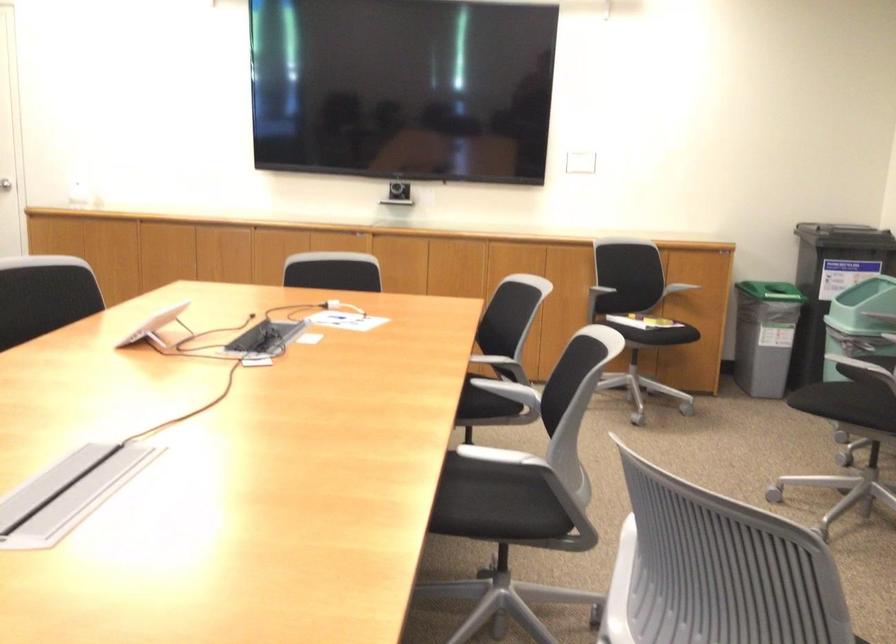
This screenshot has width=896, height=644. What do you see at coordinates (13, 189) in the screenshot? I see `the silver door handle` at bounding box center [13, 189].